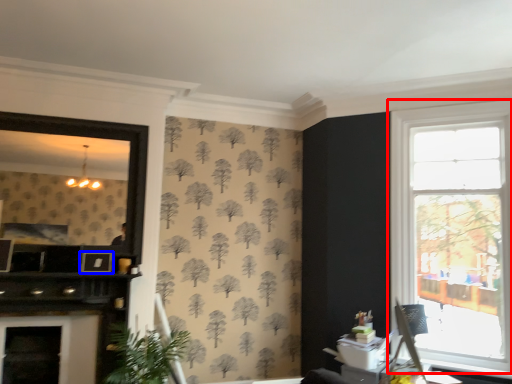
Question: Which object appears closest to the camera in this image, window (highlighted by a red box) or picture frame (highlighted by a blue box)?

Choices:
 (A) window
 (B) picture frame

Answer: (A)